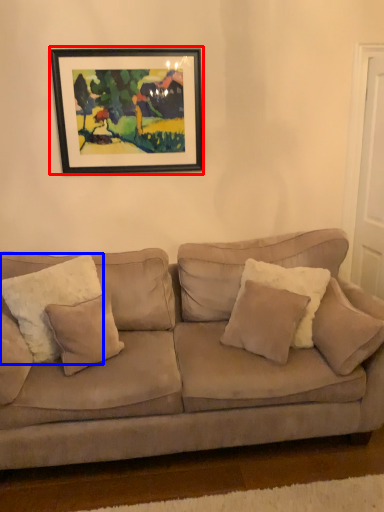
Question: Among these objects, which one is nearest to the camera, picture frame (highlighted by a red box) or pillow (highlighted by a blue box)?

Choices:
 (A) picture frame
 (B) pillow

Answer: (B)